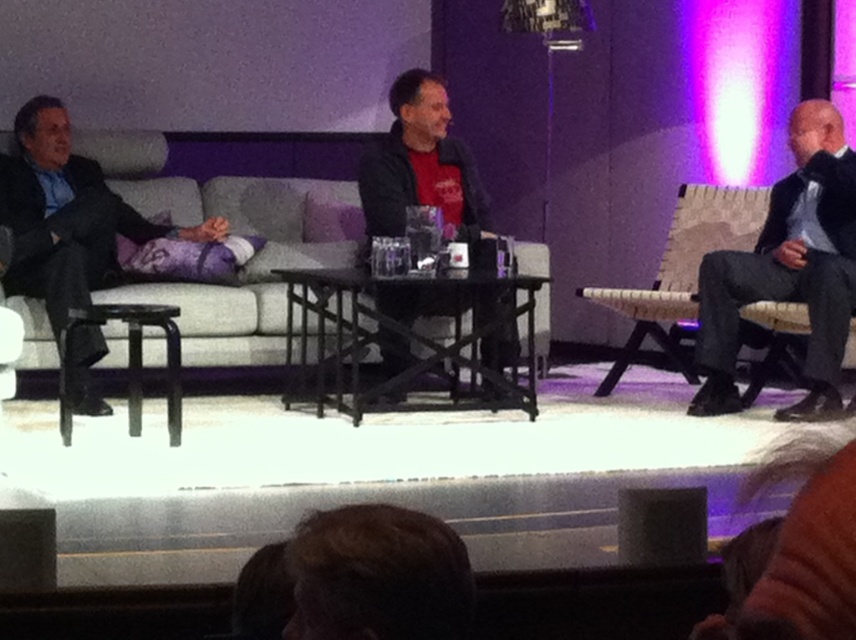
From the picture: You are sitting in the front row of the audience and want to wave to the dark gray suit at left and the woven fabric chair at right. Which one can you reach with your hand if you extend it forward?

The dark gray suit at left is closer to the viewer than the woven fabric chair at right, so you can reach the dark gray suit at left with your hand.

You are an event organizer who needs to ensure that all items on the stage are visible to the audience. The black matte jacket at center and the woven fabric chair at right are part of the stage setup. Based on their sizes, which item might block the view of the other?

The woven fabric chair at right is taller than the black matte jacket at center, so the chair could potentially block the view of the jacket if placed in front of it.